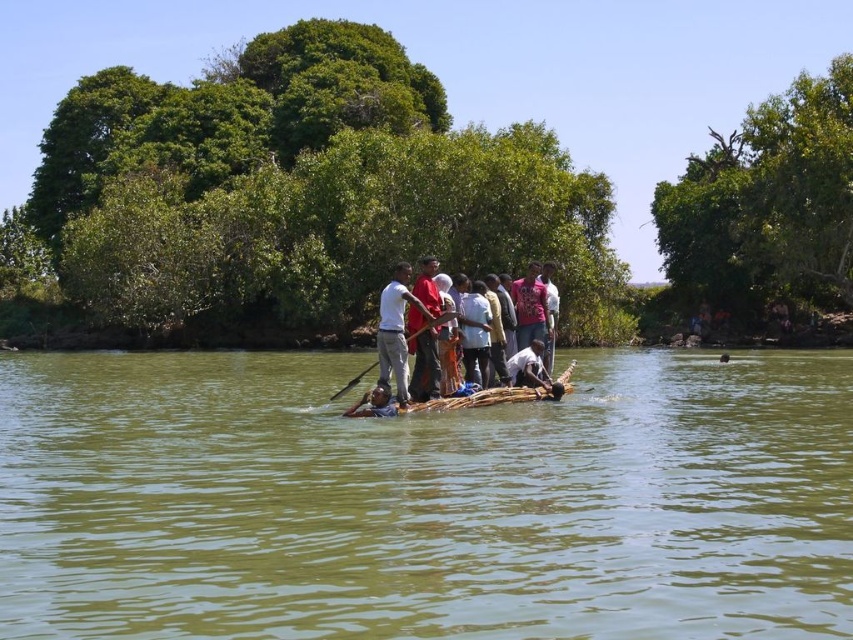
Question: Which object is farther from the camera taking this photo?

Choices:
 (A) greenish-brown wood at center
 (B) red fabric shirt at center
 (C) white cotton shirt at center
 (D) dark brown wooden raft at center

Answer: (B)

Question: Does red fabric shirt at center appear on the right side of dark brown wooden raft at center?

Choices:
 (A) no
 (B) yes

Answer: (B)

Question: Which of the following is the farthest from the observer?

Choices:
 (A) (546, 394)
 (B) (418, 365)
 (C) (415, 333)

Answer: (A)

Question: Does greenish-brown wood at center appear under wooden paddle at center?

Choices:
 (A) no
 (B) yes

Answer: (B)

Question: Which point is farther to the camera?

Choices:
 (A) click(412, 400)
 (B) click(442, 321)

Answer: (B)

Question: Does white matte shirt at center have a greater width compared to wooden paddle at center?

Choices:
 (A) no
 (B) yes

Answer: (A)